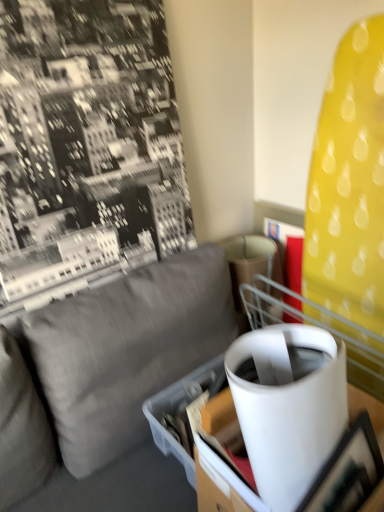
Question: Can you confirm if matte black picture frame at lower right is thinner than white glossy table at center?

Choices:
 (A) yes
 (B) no

Answer: (A)

Question: From the image's perspective, is matte black picture frame at lower right below white glossy table at center?

Choices:
 (A) no
 (B) yes

Answer: (B)

Question: Does matte black picture frame at lower right have a lesser height compared to white glossy table at center?

Choices:
 (A) yes
 (B) no

Answer: (A)

Question: Is matte black picture frame at lower right positioned far away from white glossy table at center?

Choices:
 (A) yes
 (B) no

Answer: (B)

Question: Is matte black picture frame at lower right bigger than white glossy table at center?

Choices:
 (A) yes
 (B) no

Answer: (B)

Question: In terms of width, does matte black picture frame at lower right look wider or thinner when compared to gray fabric couch at center?

Choices:
 (A) wide
 (B) thin

Answer: (B)

Question: From a real-world perspective, is matte black picture frame at lower right physically located above or below gray fabric couch at center?

Choices:
 (A) above
 (B) below

Answer: (A)

Question: Is matte black picture frame at lower right situated inside gray fabric couch at center or outside?

Choices:
 (A) outside
 (B) inside

Answer: (B)

Question: Does point (349, 487) appear closer or farther from the camera than point (216, 284)?

Choices:
 (A) farther
 (B) closer

Answer: (B)

Question: Considering the positions of white glossy table at center and cardboard box at center in the image, is white glossy table at center wider or thinner than cardboard box at center?

Choices:
 (A) thin
 (B) wide

Answer: (A)

Question: In terms of size, does white glossy table at center appear bigger or smaller than cardboard box at center?

Choices:
 (A) small
 (B) big

Answer: (B)

Question: Do you think white glossy table at center is within cardboard box at center, or outside of it?

Choices:
 (A) inside
 (B) outside

Answer: (B)

Question: Considering their positions, is white glossy table at center located in front of or behind cardboard box at center?

Choices:
 (A) behind
 (B) front

Answer: (B)

Question: Is cardboard box at center inside or outside of white glossy table at center?

Choices:
 (A) outside
 (B) inside

Answer: (A)

Question: In terms of height, does cardboard box at center look taller or shorter compared to white glossy table at center?

Choices:
 (A) short
 (B) tall

Answer: (A)